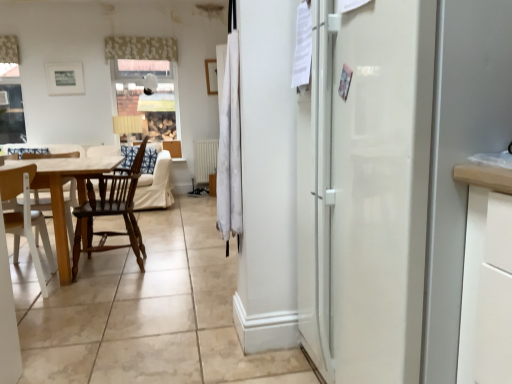
This screenshot has width=512, height=384. Describe the element at coordinates (63, 196) in the screenshot. I see `wooden table at left` at that location.

Measure the distance between point (x=199, y=147) and camera.

The distance of point (x=199, y=147) from camera is 5.96 meters.

The width and height of the screenshot is (512, 384). Find the location of `white fabric curtain at center, arranged as the 1th curtain when viewed from the front`. white fabric curtain at center, arranged as the 1th curtain when viewed from the front is located at coordinates (229, 147).

Based on their positions, is white matte radiator at center located to the left or right of white fabric curtain at center, placed as the first curtain when sorted from right to left?

Clearly, white matte radiator at center is on the left of white fabric curtain at center, placed as the first curtain when sorted from right to left, in the image.

Is white matte radiator at center next to white fabric curtain at center, the second curtain in the top-to-bottom sequence?

There is a gap between white matte radiator at center and white fabric curtain at center, the second curtain in the top-to-bottom sequence.

Is white matte radiator at center smaller than white fabric curtain at center, placed as the first curtain when sorted from right to left?

No.

In terms of width, does white matte radiator at center look wider or thinner when compared to white fabric curtain at center, the second curtain from the left?

Clearly, white matte radiator at center has more width compared to white fabric curtain at center, the second curtain from the left.

From the image's perspective, would you say white floral fabric at upper center, which is counted as the second curtain, starting from the bottom, is positioned over white matte radiator at center?

Indeed, from the image's perspective, white floral fabric at upper center, which is counted as the second curtain, starting from the bottom, is shown above white matte radiator at center.

Is white floral fabric at upper center, which appears as the 1th curtain when viewed from the top, facing towards white matte radiator at center?

No, white floral fabric at upper center, which appears as the 1th curtain when viewed from the top, is not oriented towards white matte radiator at center.

Is white floral fabric at upper center, the second curtain positioned from the right, thinner than white matte radiator at center?

Correct, the width of white floral fabric at upper center, the second curtain positioned from the right, is less than that of white matte radiator at center.

How different are the orientations of white floral fabric at upper center, acting as the second curtain starting from the front, and white matte radiator at center in degrees?

The angular difference between white floral fabric at upper center, acting as the second curtain starting from the front, and white matte radiator at center is 0.198 degrees.

Is white fabric curtain at center, placed as the first curtain when sorted from right to left, located within dark brown wood chair at left, arranged as the 1th chair when viewed from the right?

No, dark brown wood chair at left, arranged as the 1th chair when viewed from the right, does not contain white fabric curtain at center, placed as the first curtain when sorted from right to left.

Is dark brown wood chair at left, which ranks as the 2th chair in left-to-right order, wider or thinner than white fabric curtain at center, the second curtain from the left?

Considering their sizes, dark brown wood chair at left, which ranks as the 2th chair in left-to-right order, looks broader than white fabric curtain at center, the second curtain from the left.

In the scene shown: Is dark brown wood chair at left, which ranks as the 2th chair in left-to-right order, in front of or behind white fabric curtain at center, the second curtain from the left, in the image?

dark brown wood chair at left, which ranks as the 2th chair in left-to-right order, is behind white fabric curtain at center, the second curtain from the left.

Does white fabric curtain at center, the second curtain from the left, have a lesser width compared to white matte radiator at center?

Correct, the width of white fabric curtain at center, the second curtain from the left, is less than that of white matte radiator at center.

Is white fabric curtain at center, which is the 1th curtain from bottom to top, smaller than white matte radiator at center?

Yes, white fabric curtain at center, which is the 1th curtain from bottom to top, is smaller than white matte radiator at center.

Can you confirm if white fabric curtain at center, the second curtain in the top-to-bottom sequence, is taller than white matte radiator at center?

Indeed, white fabric curtain at center, the second curtain in the top-to-bottom sequence, has a greater height compared to white matte radiator at center.

Is white fabric curtain at center, the second curtain from the left, facing towards white matte radiator at center?

No, white fabric curtain at center, the second curtain from the left, is not turned towards white matte radiator at center.

Between white matte radiator at center and white floral fabric at upper center, the 1th curtain from the left, which one has less height?

Standing shorter between the two is white floral fabric at upper center, the 1th curtain from the left.

Between white matte radiator at center and white floral fabric at upper center, acting as the second curtain starting from the front, which one appears on the left side from the viewer's perspective?

white floral fabric at upper center, acting as the second curtain starting from the front.

Considering the relative sizes of white matte radiator at center and white floral fabric at upper center, the 1th curtain from the left, in the image provided, is white matte radiator at center thinner than white floral fabric at upper center, the 1th curtain from the left,?

No.

Can you confirm if white matte radiator at center is bigger than white floral fabric at upper center, the 1th curtain from the left?

Yes, white matte radiator at center is bigger than white floral fabric at upper center, the 1th curtain from the left.

Consider the image. Does dark brown wood chair at left, which ranks as the 2th chair in left-to-right order, appear on the right side of white floral fabric at upper center, the 1th curtain from the left?

Yes.

From the image's perspective, which is below, dark brown wood chair at left, which ranks as the 2th chair in left-to-right order, or white floral fabric at upper center, the 1th curtain from the left?

From the image's view, dark brown wood chair at left, which ranks as the 2th chair in left-to-right order, is below.

From a real-world perspective, is dark brown wood chair at left, arranged as the 1th chair when viewed from the right, located beneath white floral fabric at upper center, the first curtain when ordered from back to front?

Yes.

Between dark brown wood chair at left, which ranks as the 2th chair in left-to-right order, and white floral fabric at upper center, which appears as the 1th curtain when viewed from the top, which one is positioned in front?

dark brown wood chair at left, which ranks as the 2th chair in left-to-right order, is more forward.

Which point is more forward, (x=199, y=153) or (x=39, y=276)?

The point (x=39, y=276) is in front.

Who is bigger, white matte radiator at center or white wood chair at lower left, positioned as the 1th chair in left-to-right order?

→ With larger size is white wood chair at lower left, positioned as the 1th chair in left-to-right order.

Which object is positioned more to the right, white matte radiator at center or white wood chair at lower left, positioned as the 1th chair in left-to-right order?

white matte radiator at center is more to the right.

Does white matte radiator at center have a lesser width compared to white wood chair at lower left, positioned as the 1th chair in left-to-right order?

Indeed, white matte radiator at center has a lesser width compared to white wood chair at lower left, positioned as the 1th chair in left-to-right order.

This screenshot has width=512, height=384. I want to click on radiator below the white fabric curtain at center, the second curtain in the top-to-bottom sequence (from a real-world perspective), so click(205, 159).

There is a white matte radiator at center. Where is `the 2nd curtain above it (from a real-world perspective)`? This screenshot has width=512, height=384. the 2nd curtain above it (from a real-world perspective) is located at coordinates (141, 48).

Considering their positions, is white fabric curtain at center, placed as the first curtain when sorted from right to left, positioned further to white floral fabric at upper center, the 1th curtain from the left, than white matte radiator at center?

white fabric curtain at center, placed as the first curtain when sorted from right to left.

Based on their spatial positions, is dark brown wood chair at left, arranged as the 1th chair when viewed from the right, or wooden table at left further from white floral fabric at upper center, which appears as the 1th curtain when viewed from the top?

wooden table at left lies further to white floral fabric at upper center, which appears as the 1th curtain when viewed from the top, than the other object.

Which object lies further to the anchor point white wood chair at lower left, the second chair viewed from the right, white floral fabric at upper center, which is counted as the second curtain, starting from the bottom, or white matte radiator at center?

The object further to white wood chair at lower left, the second chair viewed from the right, is white floral fabric at upper center, which is counted as the second curtain, starting from the bottom.

When comparing their distances from white wood chair at lower left, positioned as the 1th chair in left-to-right order, does white fabric curtain at center, placed as the first curtain when sorted from right to left, or white matte radiator at center seem closer?

white fabric curtain at center, placed as the first curtain when sorted from right to left, is positioned closer to the anchor white wood chair at lower left, positioned as the 1th chair in left-to-right order.

When comparing their distances from white fabric curtain at center, arranged as the 1th curtain when viewed from the front, does white floral fabric at upper center, the first curtain when ordered from back to front, or wooden table at left seem closer?

wooden table at left is closer to white fabric curtain at center, arranged as the 1th curtain when viewed from the front.

From the image, which object appears to be nearer to dark brown wood chair at left, which ranks as the 2th chair in left-to-right order, white matte radiator at center or white wood chair at lower left, the second chair viewed from the right?

white wood chair at lower left, the second chair viewed from the right, is positioned closer to the anchor dark brown wood chair at left, which ranks as the 2th chair in left-to-right order.

When comparing their distances from white wood chair at lower left, the second chair viewed from the right, does white floral fabric at upper center, acting as the second curtain starting from the front, or white fabric curtain at center, positioned as the second curtain in back-to-front order, seem closer?

white fabric curtain at center, positioned as the second curtain in back-to-front order, lies closer to white wood chair at lower left, the second chair viewed from the right, than the other object.

Based on their spatial positions, is white floral fabric at upper center, the 1th curtain from the left, or white matte radiator at center further from dark brown wood chair at left, which ranks as the 2th chair in left-to-right order?

The object further to dark brown wood chair at left, which ranks as the 2th chair in left-to-right order, is white floral fabric at upper center, the 1th curtain from the left.

Identify the location of table between white wood chair at lower left, the second chair viewed from the right, and white floral fabric at upper center, acting as the second curtain starting from the front, in the front-back direction. 63,196.

Identify the location of curtain located between wooden table at left and white matte radiator at center in the depth direction. The width and height of the screenshot is (512, 384). (141, 48).

Identify the location of table between white wood chair at lower left, the second chair viewed from the right, and white matte radiator at center from front to back. This screenshot has width=512, height=384. (63, 196).

You are a GUI agent. You are given a task and a screenshot of the screen. Output one action in this format:
    pyautogui.click(x=<x>, y=<y>)
    Task: Click on the curtain located between white fabric curtain at center, placed as the first curtain when sorted from right to left, and white matte radiator at center in the depth direction
    
    Given the screenshot: What is the action you would take?
    pyautogui.click(x=141, y=48)